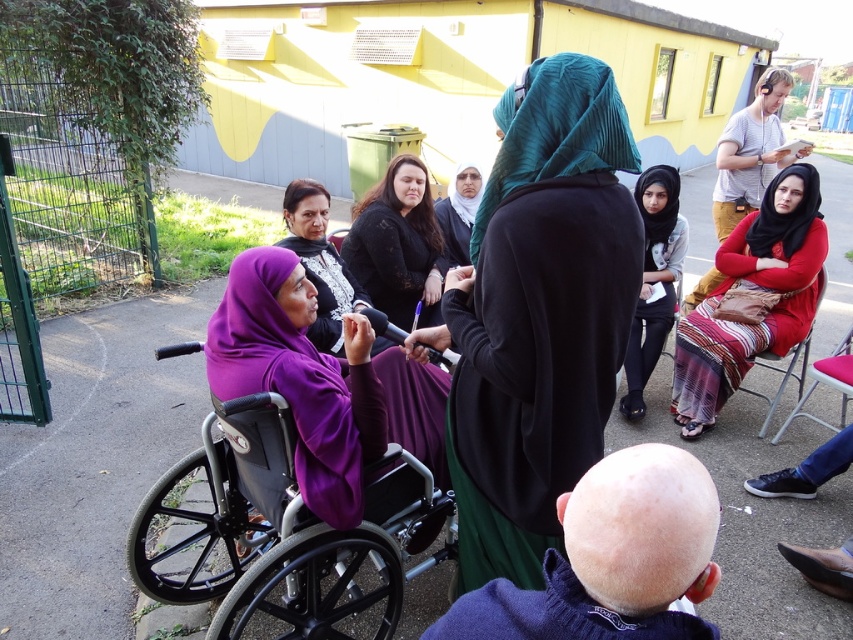
In the scene shown: You are a photographer trying to capture a photo of both the teal pleated shawl at center and the black jersey at center in the same frame. The camera you are using has a maximum focus range of 2 meters. Can you fit both objects into the frame without moving closer or farther away?

The teal pleated shawl at center and black jersey at center are 2.17 meters apart from each other. Since the distance exceeds the camera maximum focus range of 2 meters, you cannot fit both objects into the frame without adjusting your position.